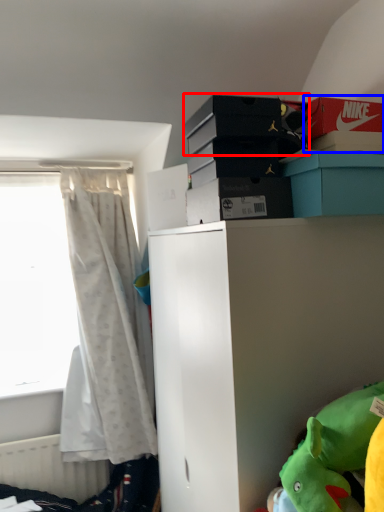
Question: Which object appears closest to the camera in this image, storage box (highlighted by a red box) or storage box (highlighted by a blue box)?

Choices:
 (A) storage box
 (B) storage box

Answer: (A)